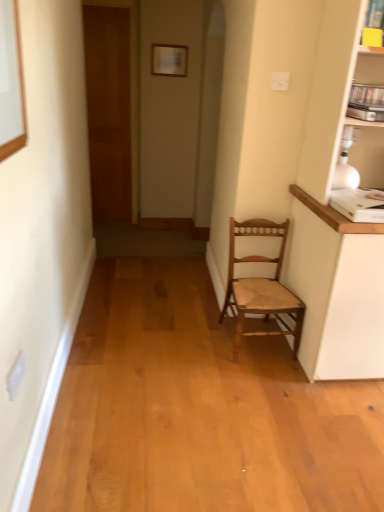
Question: Is matte white picture frame at upper center oriented towards wooden door at left?

Choices:
 (A) no
 (B) yes

Answer: (A)

Question: Is matte white picture frame at upper center surrounding wooden door at left?

Choices:
 (A) no
 (B) yes

Answer: (A)

Question: Considering the relative positions of matte white picture frame at upper center and wooden door at left in the image provided, is matte white picture frame at upper center to the right of wooden door at left from the viewer's perspective?

Choices:
 (A) yes
 (B) no

Answer: (A)

Question: From the image's perspective, is matte white picture frame at upper center under wooden door at left?

Choices:
 (A) no
 (B) yes

Answer: (A)

Question: Is the depth of matte white picture frame at upper center less than that of wooden door at left?

Choices:
 (A) no
 (B) yes

Answer: (B)

Question: Is matte white picture frame at upper center wider or thinner than wooden chair at center?

Choices:
 (A) thin
 (B) wide

Answer: (A)

Question: Would you say matte white picture frame at upper center is inside or outside wooden chair at center?

Choices:
 (A) inside
 (B) outside

Answer: (B)

Question: Is matte white picture frame at upper center bigger or smaller than wooden chair at center?

Choices:
 (A) big
 (B) small

Answer: (B)

Question: From a real-world perspective, is matte white picture frame at upper center physically located above or below wooden chair at center?

Choices:
 (A) below
 (B) above

Answer: (B)

Question: Considering the positions of wooden chair at center and matte white picture frame at upper center in the image, is wooden chair at center wider or thinner than matte white picture frame at upper center?

Choices:
 (A) thin
 (B) wide

Answer: (B)

Question: In terms of size, does wooden chair at center appear bigger or smaller than matte white picture frame at upper center?

Choices:
 (A) small
 (B) big

Answer: (B)

Question: From the image's perspective, is wooden chair at center positioned above or below matte white picture frame at upper center?

Choices:
 (A) above
 (B) below

Answer: (B)

Question: Is wooden chair at center to the left or to the right of matte white picture frame at upper center in the image?

Choices:
 (A) left
 (B) right

Answer: (B)

Question: From the image's perspective, is wooden door at left above or below wooden chair at center?

Choices:
 (A) above
 (B) below

Answer: (A)

Question: In terms of width, does wooden door at left look wider or thinner when compared to wooden chair at center?

Choices:
 (A) thin
 (B) wide

Answer: (A)